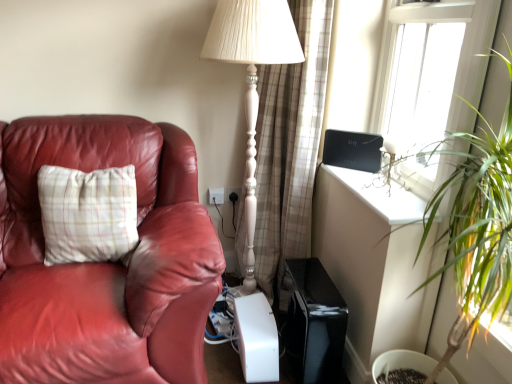
Question: Is green leafy plant at right wider or thinner than white plastic electric outlet at lower center, the first electric outlet in the left-to-right sequence?

Choices:
 (A) thin
 (B) wide

Answer: (B)

Question: Is green leafy plant at right bigger or smaller than white plastic electric outlet at lower center, the first electric outlet in the left-to-right sequence?

Choices:
 (A) small
 (B) big

Answer: (B)

Question: Which is farther from the plaid fabric pillow at left?

Choices:
 (A) plaid fabric curtain at center
 (B) white plastic electric outlet at lower center, the 2th electric outlet viewed from the right
 (C) white plastic electric outlet at lower center, which is counted as the first electric outlet, starting from the right
 (D) green leafy plant at right
 (E) transparent glass window at upper right

Answer: (E)

Question: Which is nearer to the plaid fabric curtain at center?

Choices:
 (A) white plastic electric outlet at lower center, which is counted as the first electric outlet, starting from the right
 (B) transparent glass window at upper right
 (C) white plastic electric outlet at lower center, the 2th electric outlet viewed from the right
 (D) green leafy plant at right
 (E) plaid fabric pillow at left

Answer: (B)